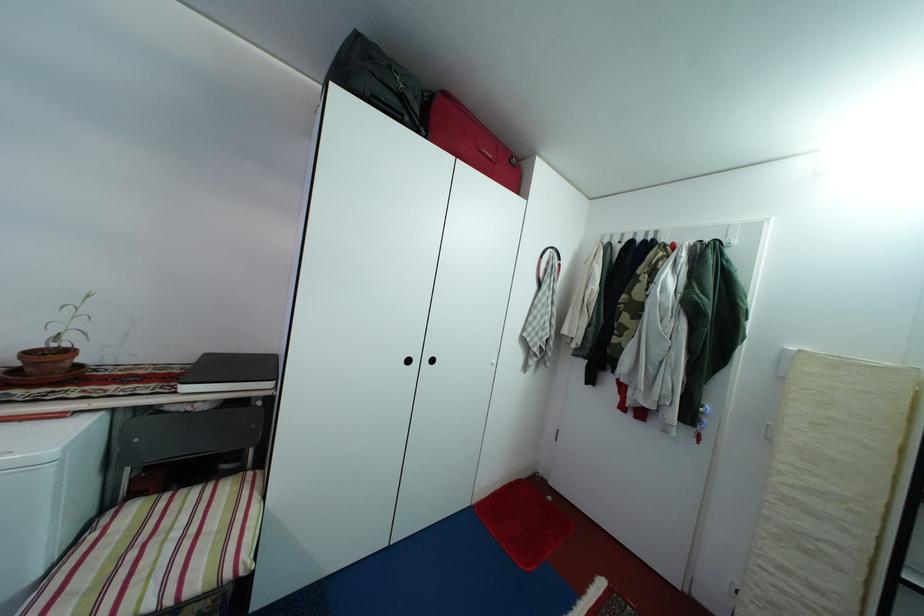
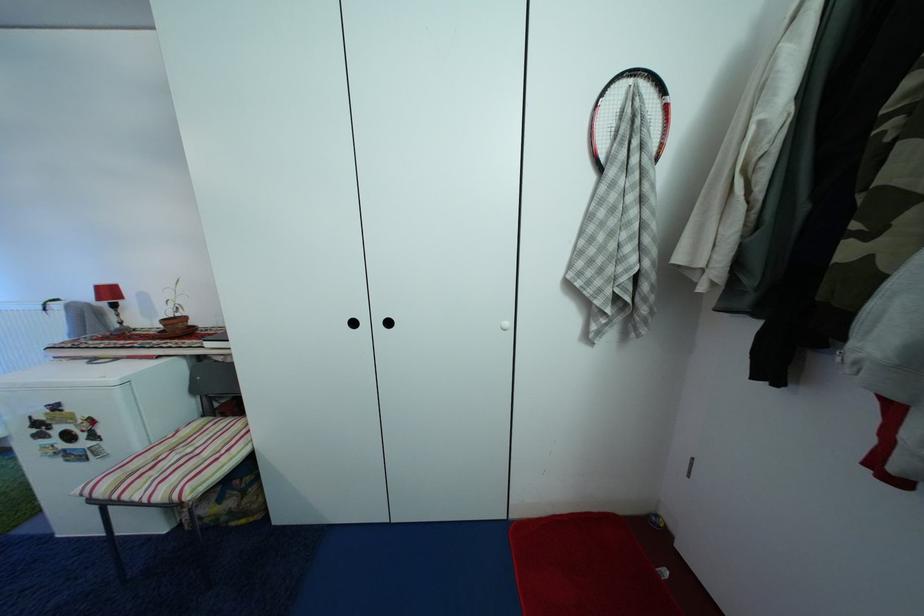
Locate, in the second image, the point that corresponds to (x=38, y=361) in the first image.

(174, 326)